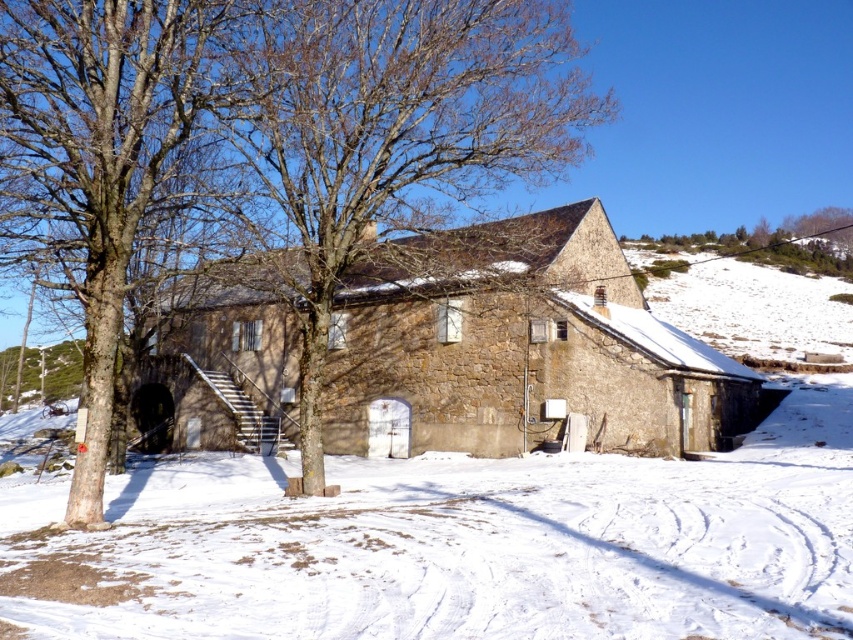
You are standing in front of the rustic stone building and notice two trees in the scene. Which tree is positioned higher up in the image, the brown bark tree at left or the green leafy tree at upper right?

The green leafy tree at upper right is positioned higher up in the image than the brown bark tree at left.

You are standing at the entrance of the rustic stone building and want to take a photo of the brown bark tree at center. Where should you position yourself to capture the tree in the center of your camera frame?

To capture the brown bark tree at center in the center of your camera frame, position yourself at the entrance of the rustic stone building and aim your camera towards the coordinates point [383,140] where the tree is located.